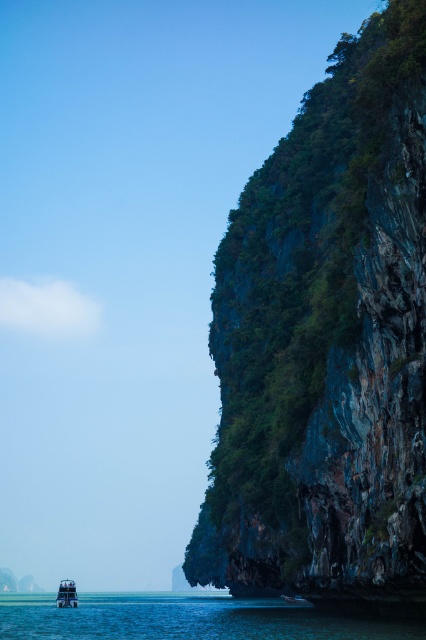
Who is more distant from viewer, (x=282, y=307) or (x=356, y=620)?

Point (x=282, y=307)

Is green rock cliff at right taller than clear blue water at lower center?

No.

At what (x,y) coordinates should I click in order to perform the action: click on green rock cliff at right. Please return your answer as a coordinate pair (x, y). This screenshot has height=640, width=426. Looking at the image, I should click on (327, 342).

Who is positioned more to the right, clear blue water at lower center or metallic silver boat at lower left?

clear blue water at lower center is more to the right.

From the picture: Between clear blue water at lower center and metallic silver boat at lower left, which one is positioned higher?

clear blue water at lower center is higher up.

Find the location of `clear blue water at lower center`. clear blue water at lower center is located at coordinates (186, 618).

Which is in front, point (417, 451) or point (72, 589)?

Positioned in front is point (417, 451).

Does green rock cliff at right lie behind metallic silver boat at lower left?

No, green rock cliff at right is in front of metallic silver boat at lower left.

At what (x,y) coordinates should I click in order to perform the action: click on green rock cliff at right. Please return your answer as a coordinate pair (x, y). The image size is (426, 640). Looking at the image, I should click on (327, 342).